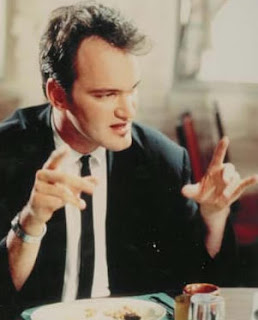
Locate an element on the screen. The width and height of the screenshot is (258, 320). chair is located at coordinates (192, 152).